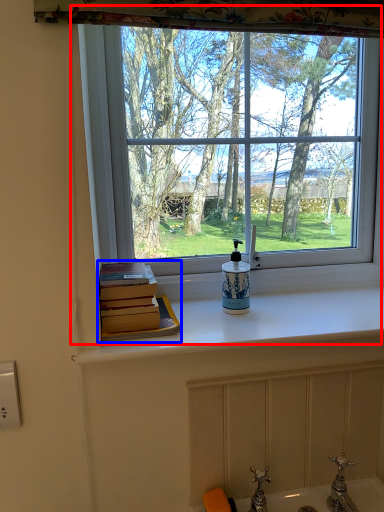
Question: Which object is closer to the camera taking this photo, window (highlighted by a red box) or book (highlighted by a blue box)?

Choices:
 (A) window
 (B) book

Answer: (B)